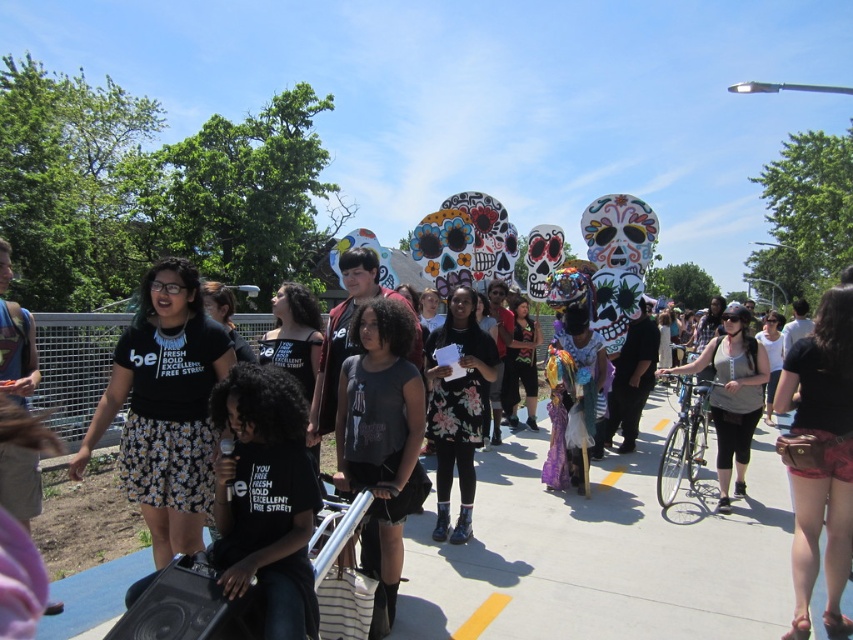
Does floral dress at center appear over matte black tank top at center?

Yes.

Who is more distant from viewer, [445,483] or [741,454]?

Point [741,454]

At what (x,y) coordinates should I click in order to perform the action: click on floral dress at center. Please return your answer as a coordinate pair (x, y). Looking at the image, I should click on (457, 406).

At what (x,y) coordinates should I click in order to perform the action: click on floral dress at center. Please return your answer as a coordinate pair (x, y). Image resolution: width=853 pixels, height=640 pixels. Looking at the image, I should click on (457, 406).

Which is above, gray concrete pavement at center or leather belt at lower right?

leather belt at lower right

Is gray concrete pavement at center smaller than leather belt at lower right?

Yes.

Does point (480, 506) come in front of point (816, 323)?

That is False.

You are a GUI agent. You are given a task and a screenshot of the screen. Output one action in this format:
    pyautogui.click(x=<x>, y=<y>)
    Task: Click on the gray concrete pavement at center
    Image resolution: width=853 pixels, height=640 pixels.
    Given the screenshot: What is the action you would take?
    pyautogui.click(x=604, y=554)

The width and height of the screenshot is (853, 640). What do you see at coordinates (165, 406) in the screenshot?
I see `black fabric shirt at center` at bounding box center [165, 406].

Does black fabric shirt at center appear under dark gray fabric shirt at center?

Incorrect, black fabric shirt at center is not positioned below dark gray fabric shirt at center.

Find the location of a particular element. black fabric shirt at center is located at coordinates (165, 406).